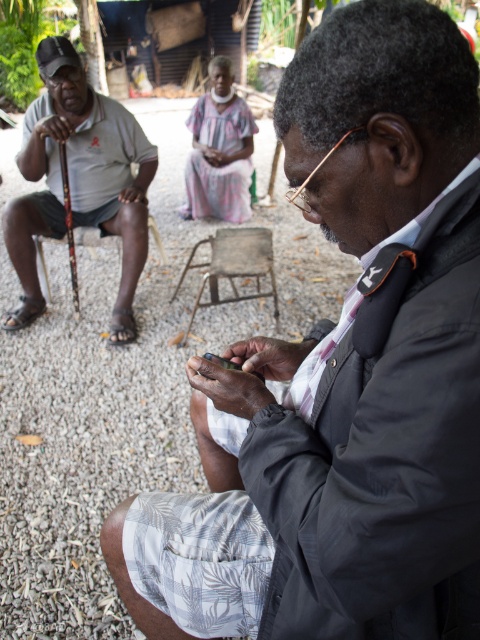
Question: Which point appears closest to the camera in this image?

Choices:
 (A) (154, 241)
 (B) (273, 260)
 (C) (134, 209)

Answer: (C)

Question: Which object appears closest to the camera in this image?

Choices:
 (A) metallic stool at center
 (B) wooden cane at left

Answer: (A)

Question: Does matte gray shirt at left have a lesser width compared to wooden cane at left?

Choices:
 (A) no
 (B) yes

Answer: (A)

Question: Is matte gray shirt at left to the right of wooden cane at left from the viewer's perspective?

Choices:
 (A) yes
 (B) no

Answer: (B)

Question: Which point is farther to the camera?

Choices:
 (A) (82, 240)
 (B) (80, 157)

Answer: (A)

Question: Can you confirm if matte gray shirt at left is positioned to the right of metallic stool at center?

Choices:
 (A) yes
 (B) no

Answer: (B)